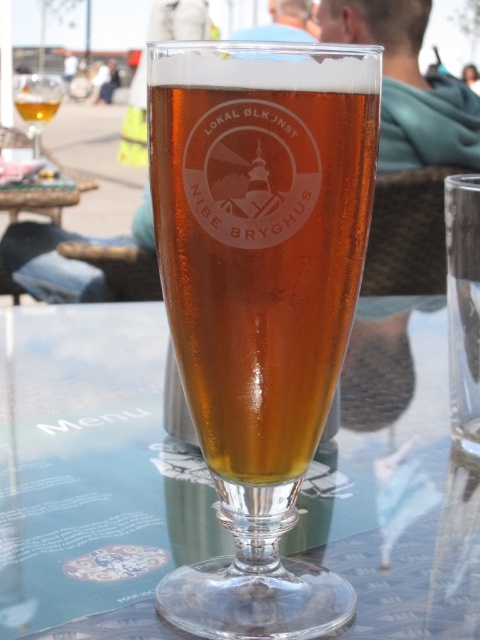
Which is above, translucent glass beer glass at center or amber glass beer at center?

amber glass beer at center is higher up.

Is translucent glass beer glass at center above amber glass beer at center?

Incorrect, translucent glass beer glass at center is not positioned above amber glass beer at center.

Identify the location of translucent glass beer glass at center. The height and width of the screenshot is (640, 480). coord(260,300).

Measure the distance between transparent glass table at center and amber glass beer at center.

transparent glass table at center is 13.94 inches away from amber glass beer at center.

Can you confirm if transparent glass table at center is wider than amber glass beer at center?

Correct, the width of transparent glass table at center exceeds that of amber glass beer at center.

Where is `transparent glass table at center`? The height and width of the screenshot is (640, 480). transparent glass table at center is located at coordinates (93, 476).

Find the location of a particular element. transparent glass table at center is located at coordinates (93, 476).

Can you confirm if translucent glass wine at upper left is shorter than amber glass beer at center?

No, translucent glass wine at upper left is not shorter than amber glass beer at center.

Between point (25, 77) and point (54, 113), which one is positioned in front?

Point (25, 77) is in front.

Where is `translucent glass wine at upper left`? The height and width of the screenshot is (640, 480). translucent glass wine at upper left is located at coordinates (36, 102).